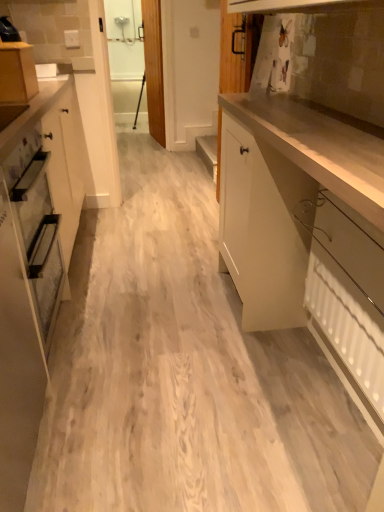
Question: From the image's perspective, is glossy white cabinet at right, the 3th cabinetry positioned from the left, located beneath white glossy cabinet at left, the 2th cabinetry positioned from the right?

Choices:
 (A) yes
 (B) no

Answer: (B)

Question: Does glossy white cabinet at right, which appears as the first cabinetry when viewed from the right, appear on the left side of white glossy cabinet at left, the 2th cabinetry when ordered from left to right?

Choices:
 (A) no
 (B) yes

Answer: (A)

Question: From a real-world perspective, is glossy white cabinet at right, the 3th cabinetry positioned from the left, on top of white glossy cabinet at left, the 2th cabinetry when ordered from left to right?

Choices:
 (A) yes
 (B) no

Answer: (B)

Question: Is glossy white cabinet at right, which appears as the first cabinetry when viewed from the right, further to camera compared to white glossy cabinet at left, the 2th cabinetry positioned from the right?

Choices:
 (A) yes
 (B) no

Answer: (B)

Question: Is glossy white cabinet at right, which appears as the first cabinetry when viewed from the right, facing away from white glossy cabinet at left, the 2th cabinetry when ordered from left to right?

Choices:
 (A) yes
 (B) no

Answer: (B)

Question: Considering the positions of glossy white cabinet at right, which appears as the first cabinetry when viewed from the right, and white textured radiator at lower right in the image, is glossy white cabinet at right, which appears as the first cabinetry when viewed from the right, bigger or smaller than white textured radiator at lower right?

Choices:
 (A) big
 (B) small

Answer: (A)

Question: Is glossy white cabinet at right, the 3th cabinetry positioned from the left, taller or shorter than white textured radiator at lower right?

Choices:
 (A) tall
 (B) short

Answer: (A)

Question: From a real-world perspective, relative to white textured radiator at lower right, is glossy white cabinet at right, the 3th cabinetry positioned from the left, vertically above or below?

Choices:
 (A) below
 (B) above

Answer: (B)

Question: From the image's perspective, is glossy white cabinet at right, the 3th cabinetry positioned from the left, positioned above or below white textured radiator at lower right?

Choices:
 (A) above
 (B) below

Answer: (A)

Question: Considering the positions of white textured radiator at lower right and matte wood cabinet at upper left, which is counted as the third cabinetry, starting from the right, in the image, is white textured radiator at lower right taller or shorter than matte wood cabinet at upper left, which is counted as the third cabinetry, starting from the right,?

Choices:
 (A) tall
 (B) short

Answer: (A)

Question: Is white textured radiator at lower right to the left or to the right of matte wood cabinet at upper left, which is counted as the third cabinetry, starting from the right, in the image?

Choices:
 (A) left
 (B) right

Answer: (B)

Question: Considering their positions, is white textured radiator at lower right located in front of or behind matte wood cabinet at upper left, which is counted as the third cabinetry, starting from the right?

Choices:
 (A) behind
 (B) front

Answer: (B)

Question: In terms of width, does white textured radiator at lower right look wider or thinner when compared to matte wood cabinet at upper left, which is counted as the third cabinetry, starting from the right?

Choices:
 (A) wide
 (B) thin

Answer: (B)

Question: Is white textured radiator at lower right wider or thinner than white glossy cabinet at left, the 2th cabinetry positioned from the right?

Choices:
 (A) thin
 (B) wide

Answer: (A)

Question: From the image's perspective, is white textured radiator at lower right located above or below white glossy cabinet at left, the 2th cabinetry when ordered from left to right?

Choices:
 (A) below
 (B) above

Answer: (B)